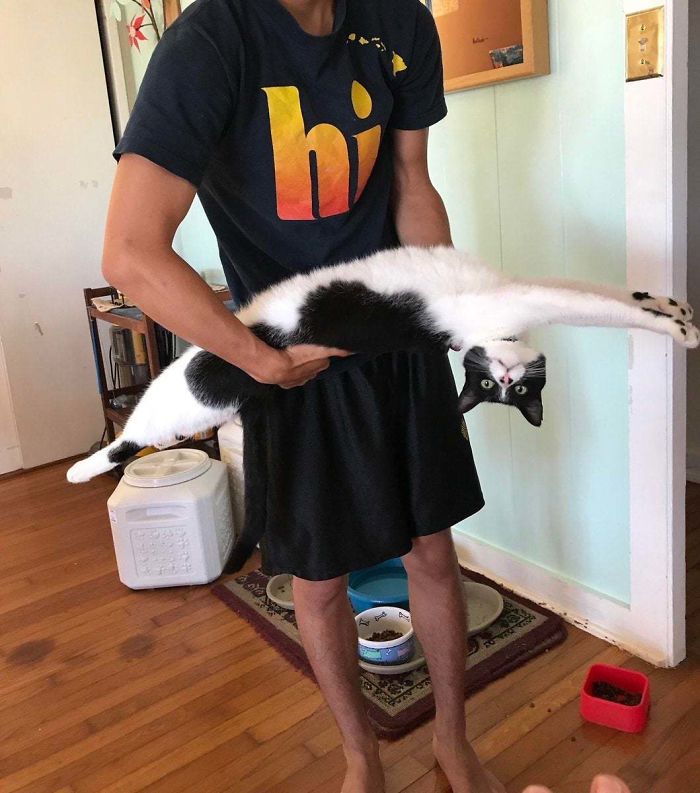
Identify the location of dish. (623, 706).